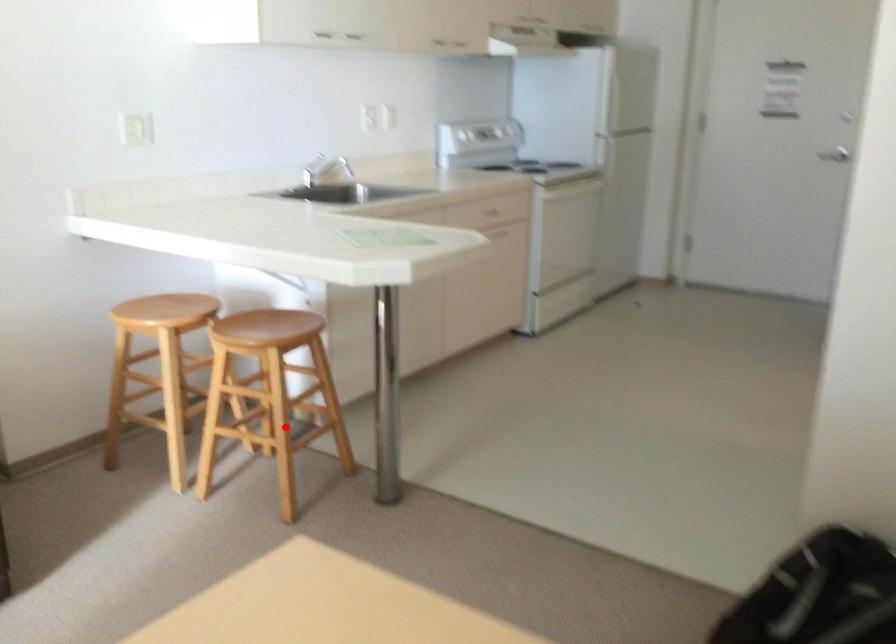
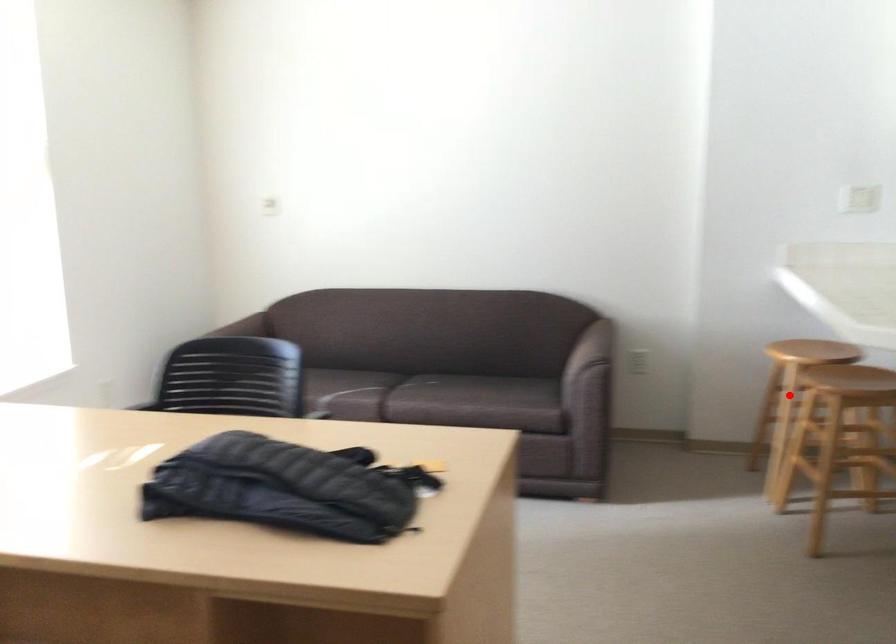
I am providing you with two images of the same scene from different viewpoints. A red point is marked on the first image and another point is marked on the second image. Do the highlighted points in image1 and image2 indicate the same real-world spot?

No